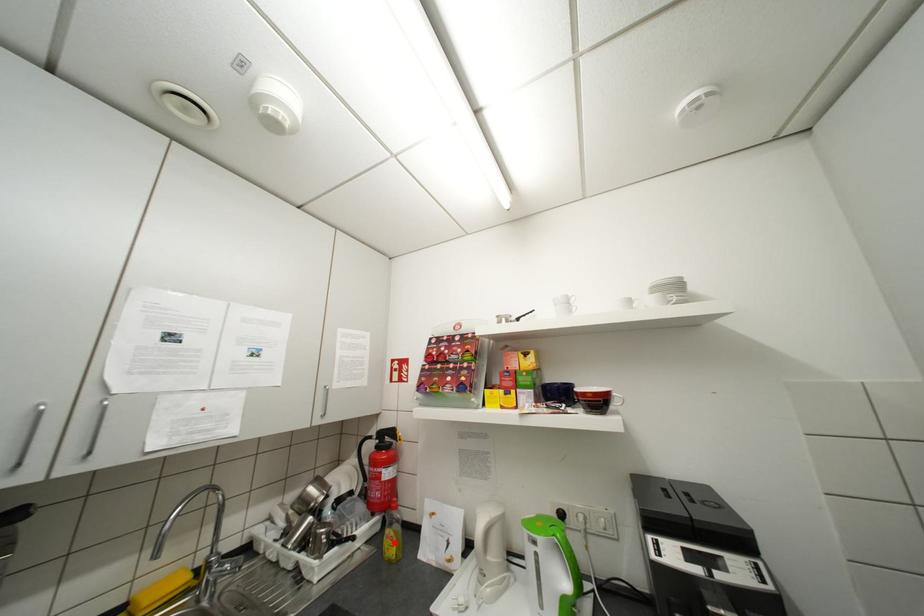
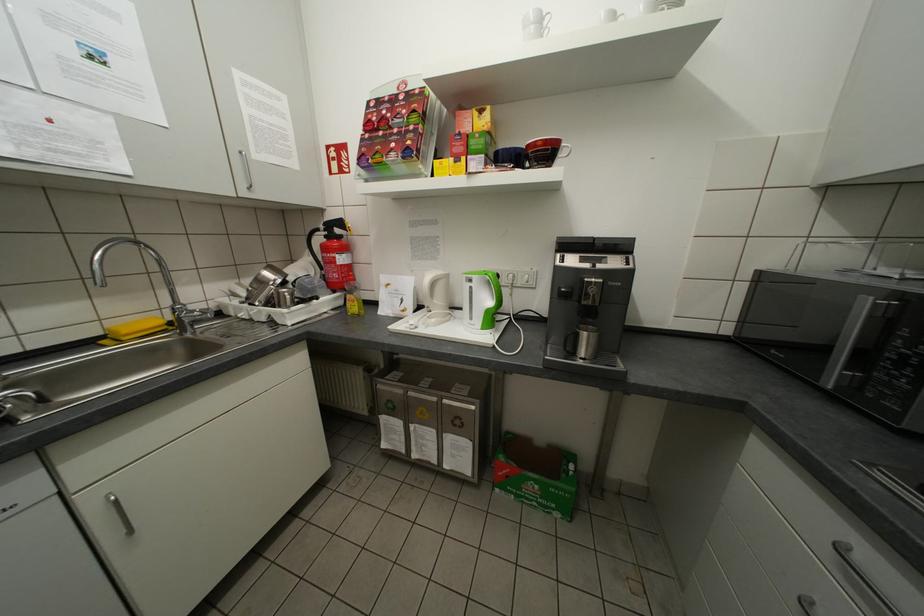
The point at the highlighted location is marked in the first image. Where is the corresponding point in the second image?

(357, 305)